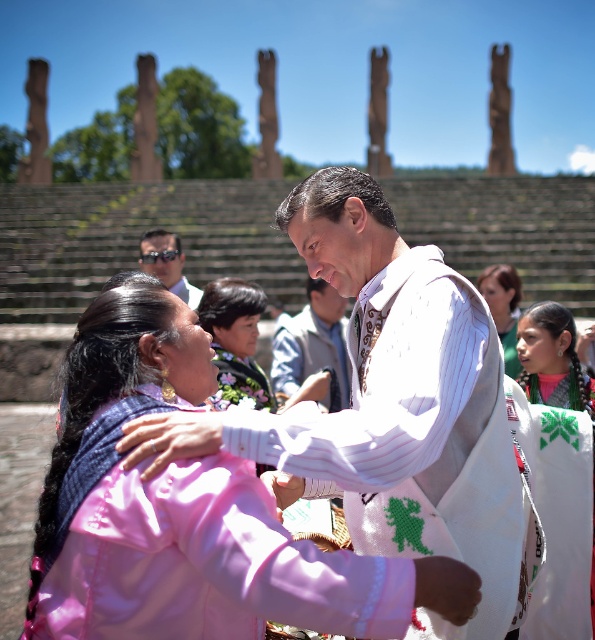
Question: Can you confirm if white striped sweater at center is bigger than matte green dress at center?

Choices:
 (A) yes
 (B) no

Answer: (B)

Question: Which point appears closest to the camera in this image?

Choices:
 (A) pyautogui.click(x=512, y=339)
 (B) pyautogui.click(x=508, y=596)
 (C) pyautogui.click(x=240, y=403)
 (D) pyautogui.click(x=328, y=348)

Answer: (B)

Question: Can you confirm if white striped sweater at center is positioned above light gray fabric shirt at center?

Choices:
 (A) no
 (B) yes

Answer: (A)

Question: Is white striped sweater at center smaller than matte black sunglasses at upper left?

Choices:
 (A) no
 (B) yes

Answer: (B)

Question: Which point appears farthest from the camera in this image?

Choices:
 (A) 516,372
 (B) 142,241
 (C) 458,477

Answer: (B)

Question: Among these objects, which one is farthest from the camera?

Choices:
 (A) embroidered fabric blouse at center
 (B) light gray fabric shirt at center
 (C) pink fabric at center
 (D) matte green dress at center

Answer: (D)